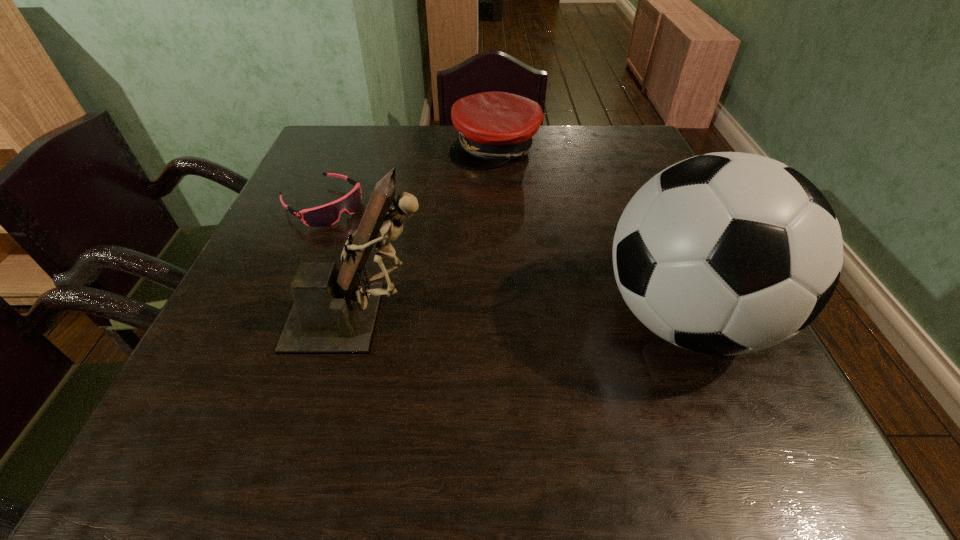
Where is `object that is at the near left corner`? The image size is (960, 540). object that is at the near left corner is located at coordinates [x=334, y=312].

The image size is (960, 540). Identify the location of object positioned at the near right corner. (727, 253).

In the image, there is a desktop. Where is `blank space at the far edge`? This screenshot has width=960, height=540. blank space at the far edge is located at coordinates (520, 156).

The width and height of the screenshot is (960, 540). I want to click on vacant region at the near edge of the desktop, so click(x=429, y=376).

Where is `vacant space at the left edge of the desktop`? vacant space at the left edge of the desktop is located at coordinates coord(250,286).

The width and height of the screenshot is (960, 540). What are the coordinates of `vacant space at the right edge of the desktop` in the screenshot? It's located at (645, 182).

Image resolution: width=960 pixels, height=540 pixels. In the image, there is a desktop. What are the coordinates of `vacant space at the far left corner` in the screenshot? It's located at (361, 142).

In the image, there is a desktop. At what (x,y) coordinates should I click in order to perform the action: click on vacant space at the near left corner. Please return your answer as a coordinate pair (x, y). Looking at the image, I should click on (266, 393).

Where is `vacant space at the far right corner`? vacant space at the far right corner is located at coordinates 605,140.

Where is `vacant area between the second object from right to left and the rightmost object`? This screenshot has height=540, width=960. vacant area between the second object from right to left and the rightmost object is located at coordinates (589, 233).